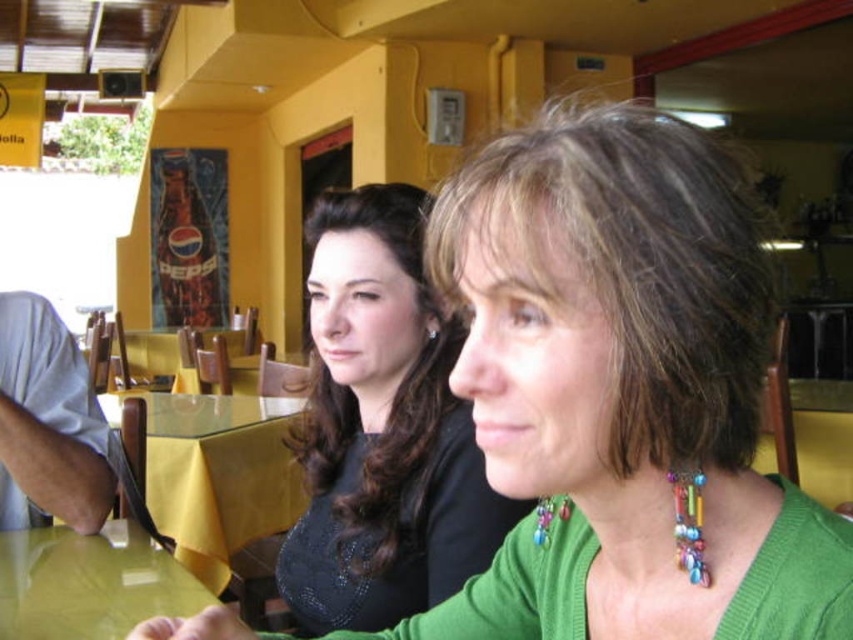
You are a photographer setting up a shot of the two people at the table. The glossy yellow table at lower left and the multicolored beads necklace at center are both in your view. Which object is positioned lower in the frame?

The glossy yellow table at lower left is positioned lower in the frame than the multicolored beads necklace at center.

You are a photographer trying to capture a closeup shot of the multicolored beads necklace at center. The green matte sweater at center is blocking your view. Can you adjust your position to get a clear shot without moving any objects?

The green matte sweater at center is closer to the viewer than the multicolored beads necklace at center, so you need to move your camera position closer to the necklace to get it in focus while the sweater is out of frame.

You are standing in the dining area and want to place a small decoration between the two points labeled point (132, 582) and point (697, 483). Since the decoration needs to be placed closer to the viewer, which point should you use as the reference for placement?

Point (132, 582) is further to the viewer than point (697, 483), so you should use point (132, 582) as the reference for placing the decoration closer to the viewer.